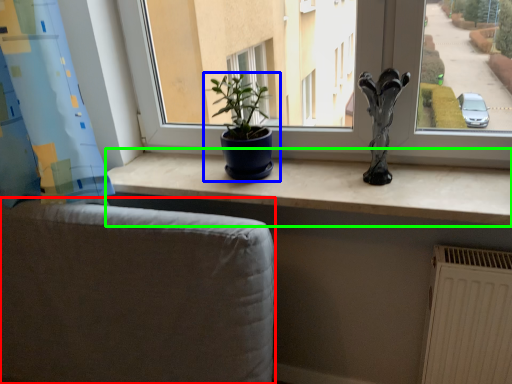
Question: Which object is positioned closest to armchair (highlighted by a red box)? Select from houseplant (highlighted by a blue box) and counter top (highlighted by a green box).

Choices:
 (A) houseplant
 (B) counter top

Answer: (B)